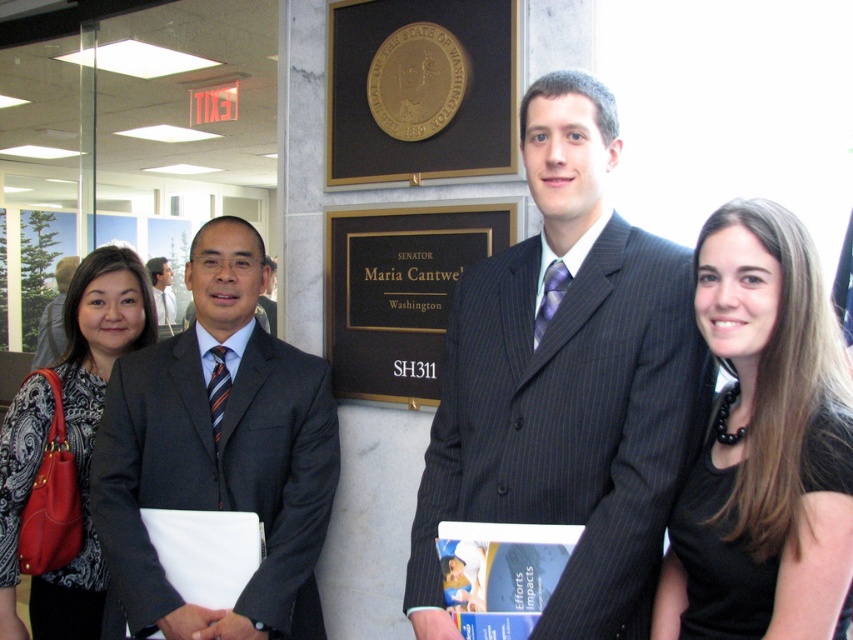
Question: Can you confirm if gold/black plaque at center is positioned above matte black suit at left?

Choices:
 (A) no
 (B) yes

Answer: (A)

Question: Is patterned fabric blouse at left in front of matte black suit at left?

Choices:
 (A) yes
 (B) no

Answer: (A)

Question: Estimate the real-world distances between objects in this image. Which object is closer to the dark gray suit at center?

Choices:
 (A) matte black suit at center
 (B) matte black suit at left
 (C) patterned fabric blouse at left
 (D) gold/black plaque at center

Answer: (B)

Question: Which object is closer to the camera taking this photo?

Choices:
 (A) pinstriped suit at center
 (B) matte black suit at left

Answer: (A)

Question: Where is gold/black plaque at center located in relation to matte black suit at left in the image?

Choices:
 (A) above
 (B) below

Answer: (B)

Question: Among these objects, which one is farthest from the camera?

Choices:
 (A) pinstriped suit at center
 (B) matte black suit at left
 (C) matte black suit at center

Answer: (B)